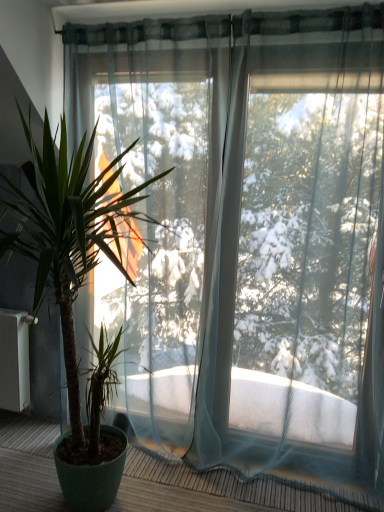
Question: From a real-world perspective, is transparent fabric balcony at lower left on top of green glossy plant at left?

Choices:
 (A) yes
 (B) no

Answer: (B)

Question: Considering the relative sizes of transparent fabric balcony at lower left and green glossy plant at left in the image provided, is transparent fabric balcony at lower left smaller than green glossy plant at left?

Choices:
 (A) no
 (B) yes

Answer: (B)

Question: Considering the relative sizes of transparent fabric balcony at lower left and green glossy plant at left in the image provided, is transparent fabric balcony at lower left wider than green glossy plant at left?

Choices:
 (A) yes
 (B) no

Answer: (B)

Question: Does transparent fabric balcony at lower left appear on the right side of green glossy plant at left?

Choices:
 (A) yes
 (B) no

Answer: (A)

Question: Is green glossy plant at left a part of transparent fabric balcony at lower left?

Choices:
 (A) yes
 (B) no

Answer: (B)

Question: Is transparent fabric balcony at lower left completely or partially outside of green glossy plant at left?

Choices:
 (A) no
 (B) yes

Answer: (B)

Question: From the image's perspective, would you say green glossy plant at left is shown under transparent fabric balcony at lower left?

Choices:
 (A) no
 (B) yes

Answer: (A)

Question: Can you confirm if green glossy plant at left is bigger than transparent fabric balcony at lower left?

Choices:
 (A) yes
 (B) no

Answer: (A)

Question: From a real-world perspective, is green glossy plant at left positioned over transparent fabric balcony at lower left based on gravity?

Choices:
 (A) yes
 (B) no

Answer: (A)

Question: Considering the relative sizes of green glossy plant at left and transparent fabric balcony at lower left in the image provided, is green glossy plant at left thinner than transparent fabric balcony at lower left?

Choices:
 (A) no
 (B) yes

Answer: (A)

Question: Does green glossy plant at left appear on the right side of transparent fabric balcony at lower left?

Choices:
 (A) no
 (B) yes

Answer: (A)

Question: Is green glossy plant at left facing towards transparent fabric balcony at lower left?

Choices:
 (A) yes
 (B) no

Answer: (B)

Question: Is point (82, 271) closer or farther from the camera than point (321, 501)?

Choices:
 (A) closer
 (B) farther

Answer: (A)